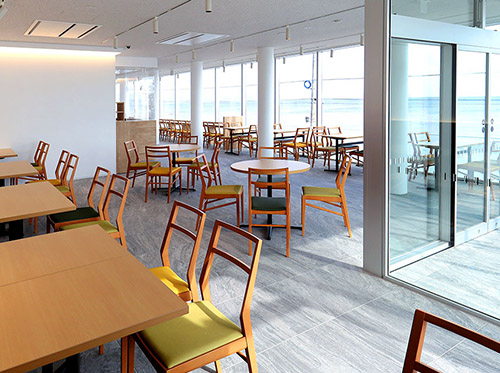
The image size is (500, 373). I want to click on floor tiles, so click(x=460, y=364), click(x=394, y=320), click(x=317, y=303), click(x=276, y=268), click(x=237, y=245), click(x=206, y=223), click(x=96, y=366), click(x=318, y=221).